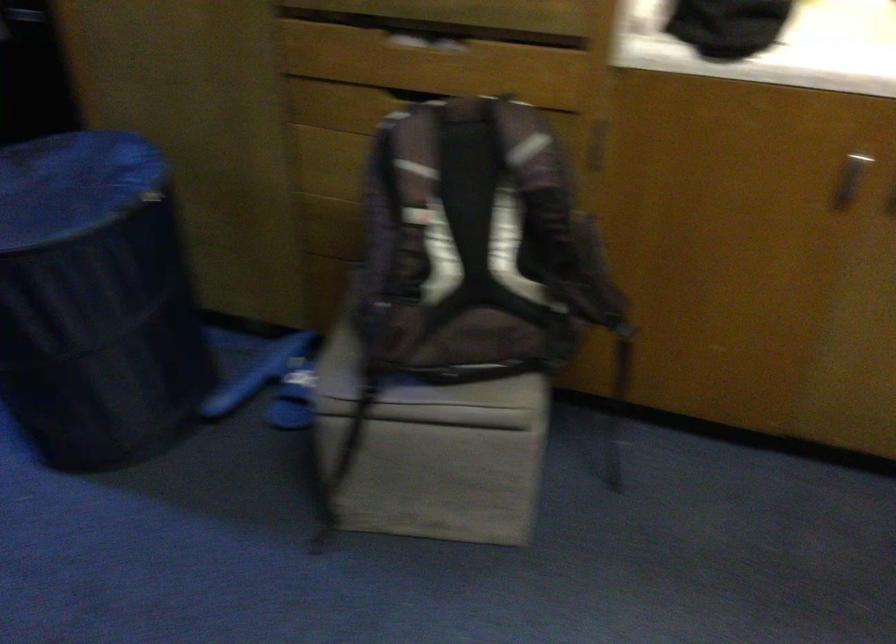
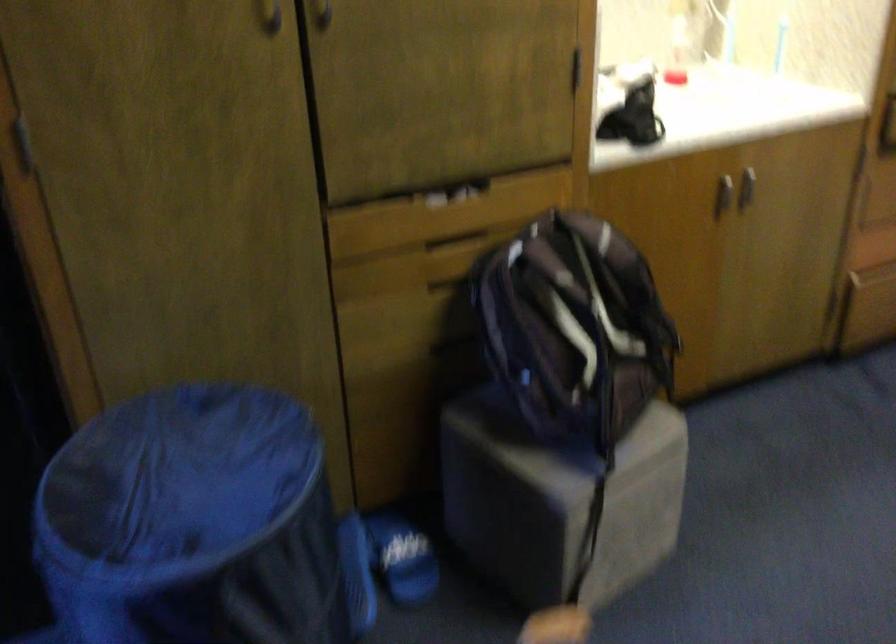
Find the pixel in the second image that matches [444,98] in the first image.

(455, 242)